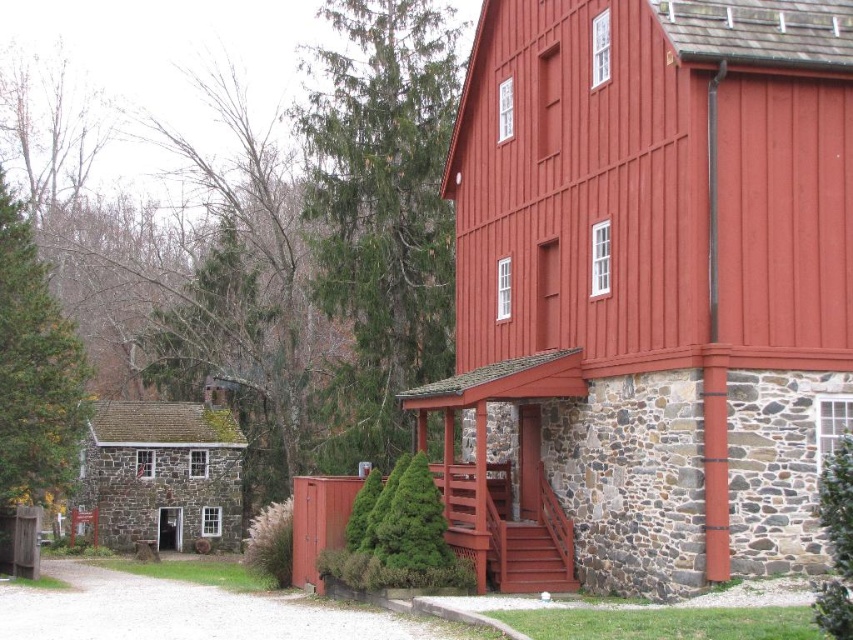
Question: Which of the following is the farthest from the observer?

Choices:
 (A) (634, 40)
 (B) (369, 108)

Answer: (B)

Question: Observing the image, what is the correct spatial positioning of smooth wooden barn at center in reference to gray gravel driveway at lower left?

Choices:
 (A) below
 (B) above

Answer: (B)

Question: Is the position of stone house at lower left more distant than that of smooth wooden stairs at center?

Choices:
 (A) yes
 (B) no

Answer: (A)

Question: Which of the following is the farthest from the observer?

Choices:
 (A) stone house at lower left
 (B) green leafy tree at center-right
 (C) smooth wooden stairs at center
 (D) gray gravel driveway at lower left

Answer: (A)

Question: Which of these objects is positioned closest to the smooth wooden barn at center?

Choices:
 (A) green textured pine tree at left
 (B) green leafy tree at center-right
 (C) stone house at lower left

Answer: (B)

Question: Where is gray gravel driveway at lower left located in relation to smooth wooden stairs at center in the image?

Choices:
 (A) below
 (B) above

Answer: (A)